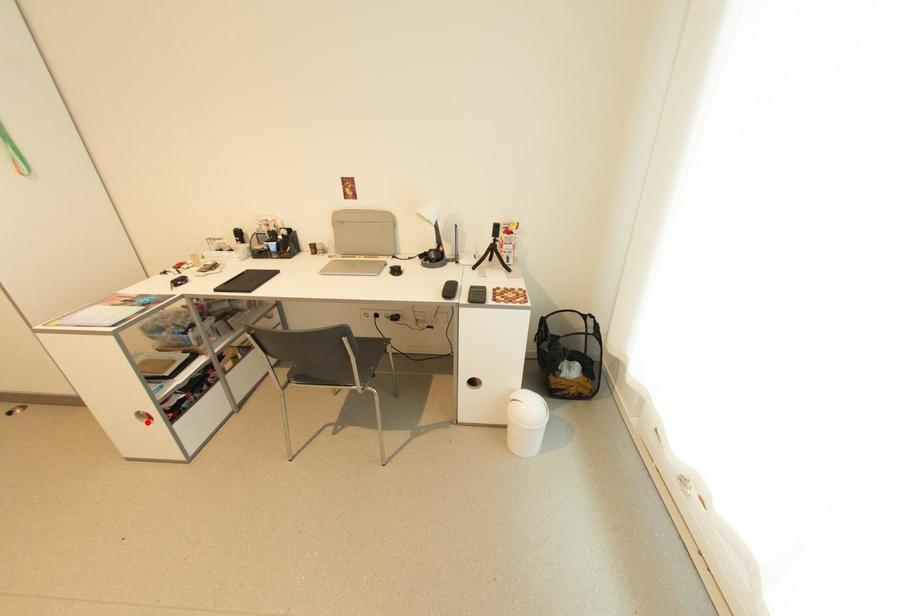
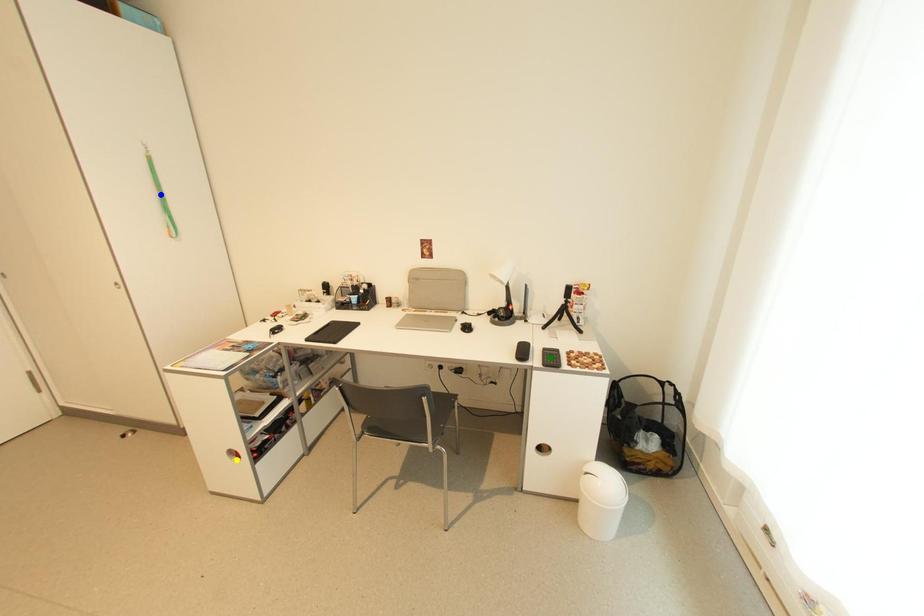
Question: I am providing you with two images of the same scene from different viewpoints. A red point is marked on the first image. You are given multiple points on the second image. Which mark in image 2 goes with the point in image 1?

Choices:
 (A) yellow point
 (B) blue point
 (C) green point

Answer: (A)